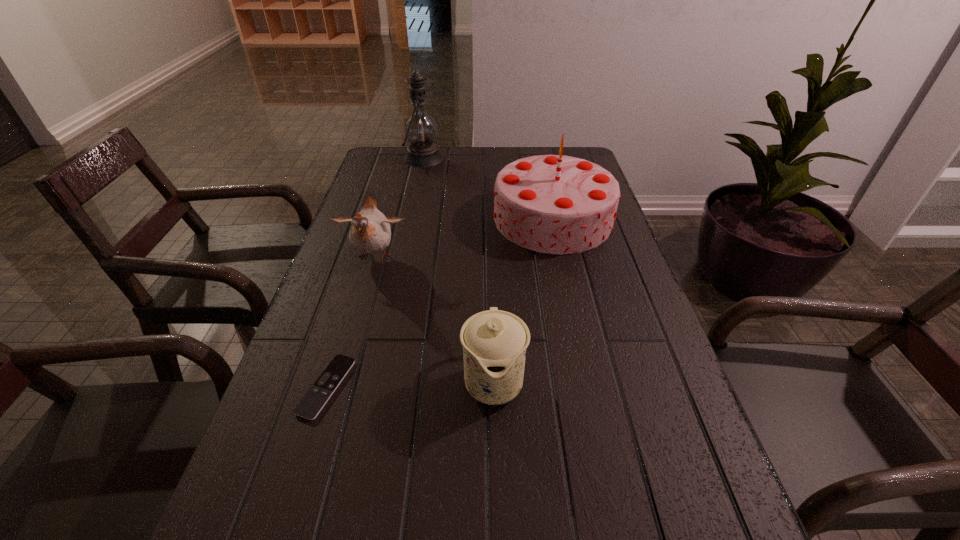
The width and height of the screenshot is (960, 540). In order to click on vacant area that lies between the bird and the remote control in this screenshot , I will do `click(350, 322)`.

Where is `free point between the farthest object and the shortest object`? free point between the farthest object and the shortest object is located at coordinates (375, 273).

The image size is (960, 540). Find the location of `free area in between the birthday cake and the chinaware`. free area in between the birthday cake and the chinaware is located at coordinates (523, 300).

Where is `vacant space that's between the shortest object and the farthest object`? Image resolution: width=960 pixels, height=540 pixels. vacant space that's between the shortest object and the farthest object is located at coordinates (375, 273).

Locate an element on the screen. The height and width of the screenshot is (540, 960). free space between the chinaware and the remote control is located at coordinates (410, 384).

The width and height of the screenshot is (960, 540). What are the coordinates of `vacant area between the remote control and the bird` in the screenshot? It's located at [350, 322].

Locate an element on the screen. object that is the closest one to the bird is located at coordinates (556, 204).

The width and height of the screenshot is (960, 540). I want to click on object that is the fourth nearest to the birthday cake, so click(309, 407).

At what (x,y) coordinates should I click in order to perform the action: click on vacant region that satisfies the following two spatial constraints: 1. on the back side of the oil lamp; 2. on the right side of the remote control. Please return your answer as a coordinate pair (x, y). This screenshot has width=960, height=540. Looking at the image, I should click on (397, 158).